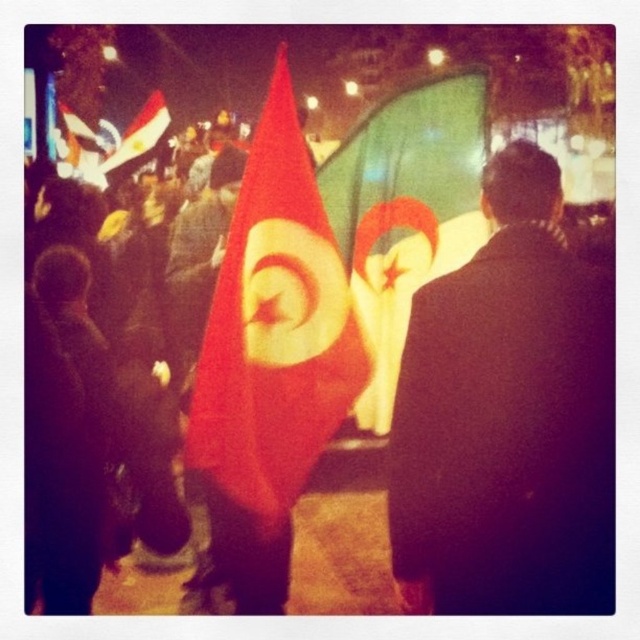
Between matte red flag at upper left and smooth skin face at center, which one has more height?

With more height is matte red flag at upper left.

Is matte red flag at upper left wider than smooth skin face at center?

Yes.

The height and width of the screenshot is (640, 640). Identify the location of matte red flag at upper left. (140, 132).

Where is `matte red flag at upper left`? matte red flag at upper left is located at coordinates (140, 132).

What do you see at coordinates (508, 417) in the screenshot? The width and height of the screenshot is (640, 640). I see `dark wool coat at center` at bounding box center [508, 417].

Between point (433, 481) and point (147, 104), which one is positioned behind?

The point (147, 104) is behind.

Between point (556, 417) and point (150, 118), which one is positioned behind?

Point (150, 118)

Identify the location of dark wool coat at center. (508, 417).

Can you confirm if red fabric flag at center is shorter than matte red flag at upper left?

Indeed, red fabric flag at center has a lesser height compared to matte red flag at upper left.

Based on the photo, is red fabric flag at center bigger than matte red flag at upper left?

Actually, red fabric flag at center might be smaller than matte red flag at upper left.

Is point (285, 284) farther from viewer compared to point (124, 147)?

No, it is not.

Where is `red fabric flag at center`? This screenshot has height=640, width=640. red fabric flag at center is located at coordinates (275, 326).